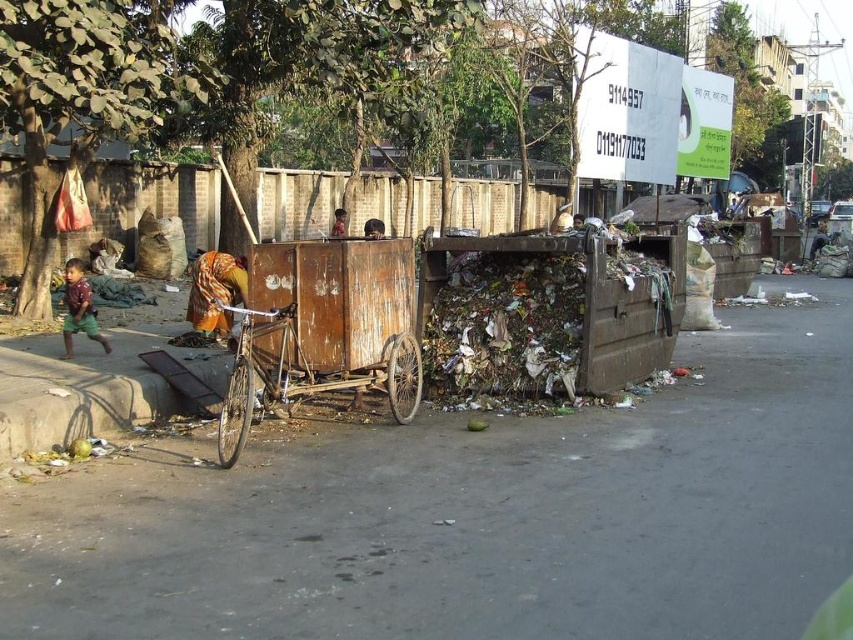
Does rusty metal cart at center appear on the right side of rusty metal bicycle at center?

Yes, rusty metal cart at center is to the right of rusty metal bicycle at center.

Which of these two, rusty metal cart at center or rusty metal bicycle at center, stands shorter?

Standing shorter between the two is rusty metal cart at center.

Identify the location of rusty metal cart at center. The image size is (853, 640). (474, 515).

Can you confirm if yellow-orange fabric at center is positioned above brown fabric at center?

Actually, yellow-orange fabric at center is below brown fabric at center.

Does yellow-orange fabric at center have a lesser width compared to brown fabric at center?

Result: Yes.

Is point (198, 296) closer to camera compared to point (340, 221)?

Yes, it is.

At what (x,y) coordinates should I click in order to perform the action: click on yellow-orange fabric at center. Please return your answer as a coordinate pair (x, y). Image resolution: width=853 pixels, height=640 pixels. Looking at the image, I should click on pyautogui.click(x=215, y=291).

Is rusty metal bicycle at center to the left of yellow-orange fabric at center from the viewer's perspective?

In fact, rusty metal bicycle at center is to the right of yellow-orange fabric at center.

Which is in front, point (300, 394) or point (207, 275)?

Point (300, 394) is more forward.

This screenshot has width=853, height=640. I want to click on rusty metal bicycle at center, so click(x=305, y=376).